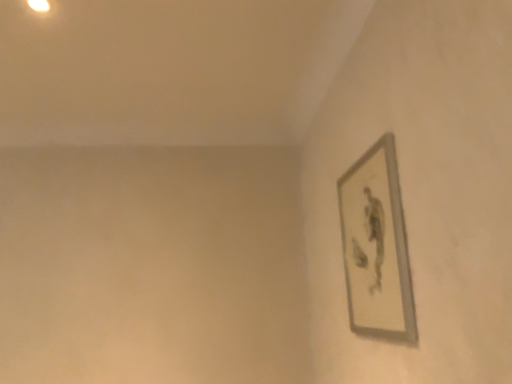
Question: Should I look upward or downward to see silver metallic picture frame at upper right?

Choices:
 (A) down
 (B) up

Answer: (A)